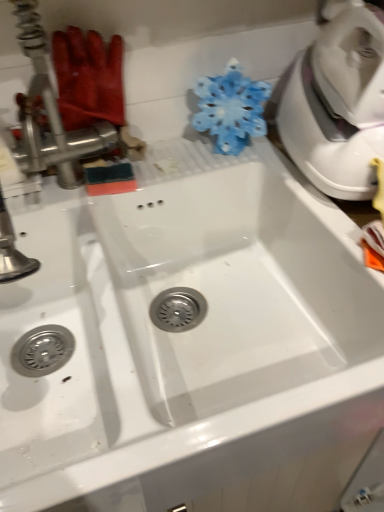
Where is `translucent plastic snowflake at upper center`? The image size is (384, 512). translucent plastic snowflake at upper center is located at coordinates (231, 108).

Describe the element at coordinates (231, 108) in the screenshot. This screenshot has width=384, height=512. I see `translucent plastic snowflake at upper center` at that location.

The image size is (384, 512). What do you see at coordinates (50, 114) in the screenshot? I see `metallic silver faucet at upper left` at bounding box center [50, 114].

Identify the location of metallic silver faucet at upper left. This screenshot has height=512, width=384. (50, 114).

This screenshot has height=512, width=384. In order to click on translucent plastic snowflake at upper center in this screenshot , I will do `click(231, 108)`.

Which is more to the right, translucent plastic snowflake at upper center or metallic silver faucet at upper left?

From the viewer's perspective, translucent plastic snowflake at upper center appears more on the right side.

Which object is closer to the camera, translucent plastic snowflake at upper center or metallic silver faucet at upper left?

metallic silver faucet at upper left.

Considering the points (255, 105) and (28, 14), which point is behind, point (255, 105) or point (28, 14)?

The point (255, 105) is farther.

From the image's perspective, relative to metallic silver faucet at upper left, is translucent plastic snowflake at upper center above or below?

translucent plastic snowflake at upper center is below metallic silver faucet at upper left.

From a real-world perspective, is translucent plastic snowflake at upper center above or below metallic silver faucet at upper left?

translucent plastic snowflake at upper center is situated lower than metallic silver faucet at upper left in the real world.

Which of these two, translucent plastic snowflake at upper center or metallic silver faucet at upper left, is wider?

With larger width is translucent plastic snowflake at upper center.

Does translucent plastic snowflake at upper center have a lesser height compared to metallic silver faucet at upper left?

Yes, translucent plastic snowflake at upper center is shorter than metallic silver faucet at upper left.

Between translucent plastic snowflake at upper center and metallic silver faucet at upper left, which one has smaller size?

Smaller between the two is metallic silver faucet at upper left.

Is translucent plastic snowflake at upper center located outside metallic silver faucet at upper left?

That's correct, translucent plastic snowflake at upper center is outside of metallic silver faucet at upper left.

Is translucent plastic snowflake at upper center not close to metallic silver faucet at upper left?

translucent plastic snowflake at upper center is near metallic silver faucet at upper left, not far away.

Could you tell me if translucent plastic snowflake at upper center is turned towards metallic silver faucet at upper left?

No, translucent plastic snowflake at upper center does not turn towards metallic silver faucet at upper left.

There is a translucent plastic snowflake at upper center. Where is `tap above it (from a real-world perspective)`? Image resolution: width=384 pixels, height=512 pixels. tap above it (from a real-world perspective) is located at coordinates (50, 114).

Considering the relative positions of metallic silver faucet at upper left and translucent plastic snowflake at upper center in the image provided, is metallic silver faucet at upper left to the right of translucent plastic snowflake at upper center from the viewer's perspective?

In fact, metallic silver faucet at upper left is to the left of translucent plastic snowflake at upper center.

Considering the positions of objects metallic silver faucet at upper left and translucent plastic snowflake at upper center in the image provided, who is in front, metallic silver faucet at upper left or translucent plastic snowflake at upper center?

metallic silver faucet at upper left is in front.

Does point (107, 127) appear closer or farther from the camera than point (222, 130)?

Clearly, point (107, 127) is closer to the camera than point (222, 130).

From the image's perspective, is metallic silver faucet at upper left on translucent plastic snowflake at upper center?

Correct, metallic silver faucet at upper left appears higher than translucent plastic snowflake at upper center in the image.

From a real-world perspective, which is physically above, metallic silver faucet at upper left or translucent plastic snowflake at upper center?

metallic silver faucet at upper left, from a real-world perspective.

Does metallic silver faucet at upper left have a greater width compared to translucent plastic snowflake at upper center?

Incorrect, the width of metallic silver faucet at upper left does not surpass that of translucent plastic snowflake at upper center.

Is metallic silver faucet at upper left taller than translucent plastic snowflake at upper center?

Indeed, metallic silver faucet at upper left has a greater height compared to translucent plastic snowflake at upper center.

Based on their sizes in the image, would you say metallic silver faucet at upper left is bigger or smaller than translucent plastic snowflake at upper center?

In the image, metallic silver faucet at upper left appears to be smaller than translucent plastic snowflake at upper center.

Is metallic silver faucet at upper left inside or outside of translucent plastic snowflake at upper center?

metallic silver faucet at upper left is outside translucent plastic snowflake at upper center.

Is there a large distance between metallic silver faucet at upper left and translucent plastic snowflake at upper center?

metallic silver faucet at upper left is near translucent plastic snowflake at upper center, not far away.

Does metallic silver faucet at upper left turn towards translucent plastic snowflake at upper center?

No, metallic silver faucet at upper left does not turn towards translucent plastic snowflake at upper center.

Can you tell me how much metallic silver faucet at upper left and translucent plastic snowflake at upper center differ in facing direction?

metallic silver faucet at upper left and translucent plastic snowflake at upper center are facing 3.53 degrees away from each other.

How distant is metallic silver faucet at upper left from translucent plastic snowflake at upper center?

metallic silver faucet at upper left is 10.35 inches from translucent plastic snowflake at upper center.

This screenshot has width=384, height=512. Identify the location of flower behind the metallic silver faucet at upper left. (231, 108).

Locate an element on the screen. flower located behind the metallic silver faucet at upper left is located at coordinates pos(231,108).

Find the location of a particular element. This screenshot has width=384, height=512. tap on the left of the translucent plastic snowflake at upper center is located at coordinates (50, 114).